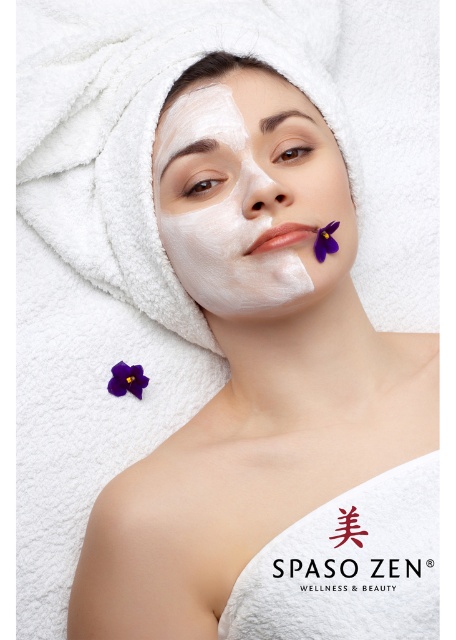
I want to click on white matte facial mask at center, so click(248, 192).

Measure the distance between point [307,136] and camera.

A distance of 28.65 inches exists between point [307,136] and camera.

Identify the location of white matte facial mask at center. The width and height of the screenshot is (456, 640). (248, 192).

Identify the location of white matte facial mask at center. The image size is (456, 640). (248, 192).

Between purple matte flower at upper center and purple matte flower at upper right, which one is positioned lower?

Positioned lower is purple matte flower at upper center.

Does point (134, 376) come behind point (316, 250)?

Yes, point (134, 376) is farther from viewer.

Identify the location of purple matte flower at upper center. Image resolution: width=456 pixels, height=640 pixels. (127, 380).

Is white matte facial mask at center shorter than purple matte flower at upper right?

No, white matte facial mask at center is not shorter than purple matte flower at upper right.

Between white matte facial mask at center and purple matte flower at upper right, which one has more height?

white matte facial mask at center is taller.

Between point (193, 161) and point (331, 252), which one is positioned behind?

Point (193, 161)

Where is `white matte facial mask at center`? This screenshot has height=640, width=456. white matte facial mask at center is located at coordinates (248, 192).